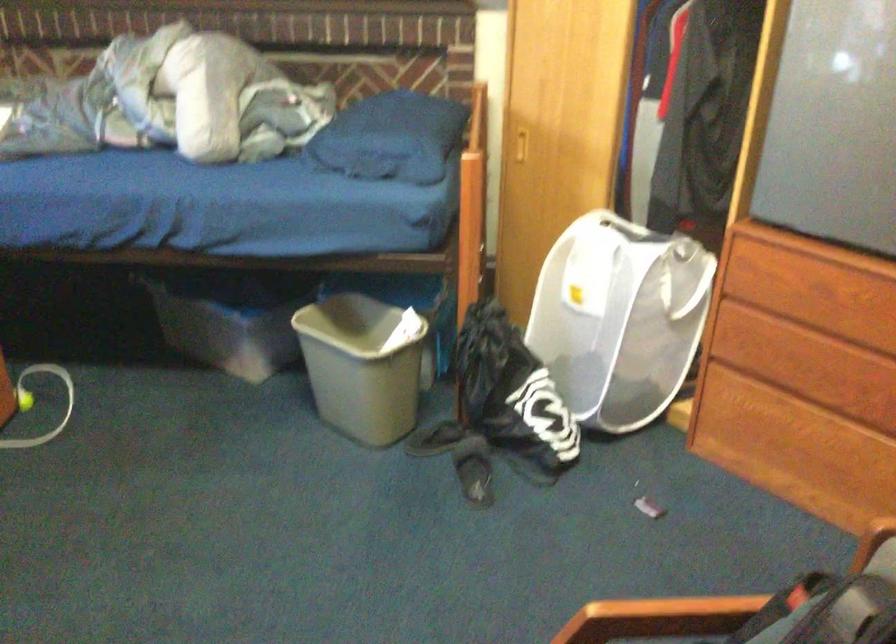
Where would you pull the dresser drawer handle? Please return your answer as a coordinate pair (x, y).

(519, 146)